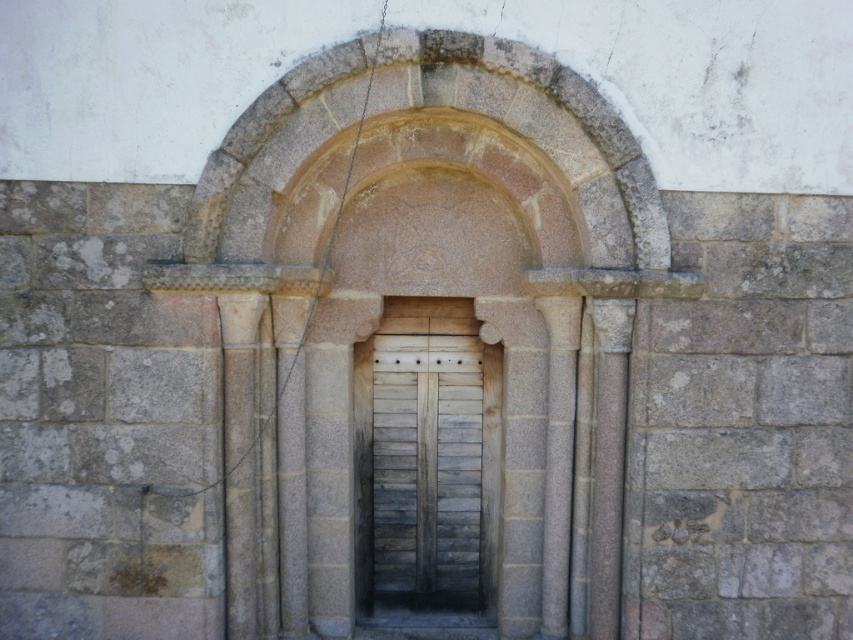
In the scene shown: Which is more to the right, weathered wood door at center or smooth stone pillar at center?

smooth stone pillar at center is more to the right.

Is point (384, 520) farther from camera compared to point (547, 499)?

Yes, it is behind point (547, 499).

Image resolution: width=853 pixels, height=640 pixels. Find the location of `weathered wood door at center`. weathered wood door at center is located at coordinates (427, 465).

In the scene shown: Who is more forward, (x=547, y=156) or (x=601, y=340)?

Point (x=547, y=156) is in front.

Is point (219, 296) behind point (625, 381)?

No, it is not.

You are a GUI agent. You are given a task and a screenshot of the screen. Output one action in this format:
    pyautogui.click(x=<x>, y=<y>)
    Task: Click on the stone textured arch at center
    Image resolution: width=853 pixels, height=640 pixels.
    Given the screenshot: What is the action you would take?
    pyautogui.click(x=403, y=288)

Can you confirm if stone textured arch at center is positioned to the left of smooth stone pillar at center?

Yes, stone textured arch at center is to the left of smooth stone pillar at center.

Is point (518, 426) closer to viewer compared to point (555, 616)?

That is False.

The height and width of the screenshot is (640, 853). What are the coordinates of `stone textured arch at center` in the screenshot? It's located at (x=403, y=288).